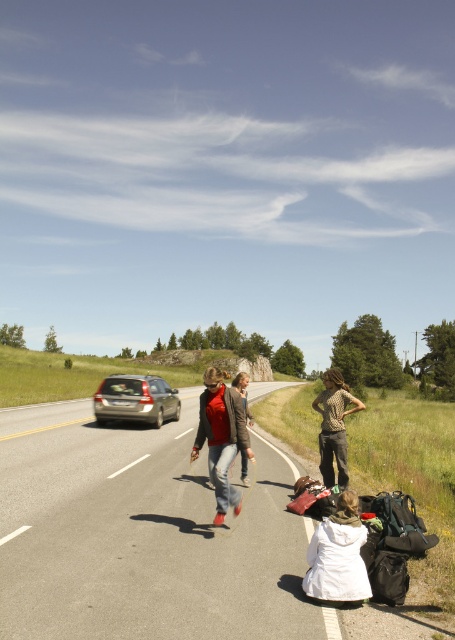
Question: Which object appears farthest from the camera in this image?

Choices:
 (A) matte red shoes at center
 (B) asphalt road at center
 (C) denim jacket at center

Answer: (C)

Question: Which point is farther from the camera taking this photo?

Choices:
 (A) (152, 419)
 (B) (249, 424)
 (C) (328, 401)
 (D) (229, 449)

Answer: (A)

Question: Does matte red shoes at center have a greater width compared to leopard print shirt at center?

Choices:
 (A) no
 (B) yes

Answer: (A)

Question: Observing the image, what is the correct spatial positioning of matte red shoes at center in reference to denim jacket at center?

Choices:
 (A) left
 (B) right

Answer: (A)

Question: Among these points, which one is nearest to the camera?

Choices:
 (A) (340, 561)
 (B) (111, 520)
 (C) (328, 436)
 (D) (241, 468)

Answer: (A)

Question: Is white cotton dress at lower center thinner than matte red shoes at center?

Choices:
 (A) yes
 (B) no

Answer: (A)